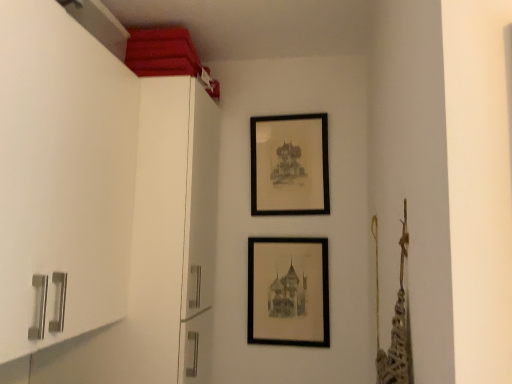
Question: Does matte black picture frame at center, positioned as the 2th picture frame in top-to-bottom order, contain black matte picture frame at upper center, which is counted as the 1th picture frame, starting from the top?

Choices:
 (A) yes
 (B) no

Answer: (B)

Question: From the image's perspective, is matte black picture frame at center, positioned as the 2th picture frame in top-to-bottom order, beneath black matte picture frame at upper center, which is counted as the 1th picture frame, starting from the top?

Choices:
 (A) yes
 (B) no

Answer: (A)

Question: Considering the relative sizes of matte black picture frame at center, arranged as the first picture frame when ordered from the bottom, and black matte picture frame at upper center, which is the 2th picture frame in bottom-to-top order, in the image provided, is matte black picture frame at center, arranged as the first picture frame when ordered from the bottom, bigger than black matte picture frame at upper center, which is the 2th picture frame in bottom-to-top order,?

Choices:
 (A) no
 (B) yes

Answer: (A)

Question: Is matte black picture frame at center, positioned as the 2th picture frame in top-to-bottom order, smaller than black matte picture frame at upper center, which is the 2th picture frame in bottom-to-top order?

Choices:
 (A) no
 (B) yes

Answer: (B)

Question: Is the depth of matte black picture frame at center, positioned as the 2th picture frame in top-to-bottom order, less than that of black matte picture frame at upper center, which is counted as the 1th picture frame, starting from the top?

Choices:
 (A) no
 (B) yes

Answer: (B)

Question: Is matte black picture frame at center, positioned as the 2th picture frame in top-to-bottom order, at the right side of black matte picture frame at upper center, which is counted as the 1th picture frame, starting from the top?

Choices:
 (A) yes
 (B) no

Answer: (B)

Question: Is black matte picture frame at upper center, which is counted as the 1th picture frame, starting from the top, to the right of matte black picture frame at center, positioned as the 2th picture frame in top-to-bottom order, from the viewer's perspective?

Choices:
 (A) yes
 (B) no

Answer: (A)

Question: From the image's perspective, would you say black matte picture frame at upper center, which is the 2th picture frame in bottom-to-top order, is shown under matte black picture frame at center, arranged as the first picture frame when ordered from the bottom?

Choices:
 (A) yes
 (B) no

Answer: (B)

Question: Considering the relative positions of black matte picture frame at upper center, which is the 2th picture frame in bottom-to-top order, and matte black picture frame at center, positioned as the 2th picture frame in top-to-bottom order, in the image provided, is black matte picture frame at upper center, which is the 2th picture frame in bottom-to-top order, to the left of matte black picture frame at center, positioned as the 2th picture frame in top-to-bottom order, from the viewer's perspective?

Choices:
 (A) yes
 (B) no

Answer: (B)

Question: Considering the relative sizes of black matte picture frame at upper center, which is the 2th picture frame in bottom-to-top order, and matte black picture frame at center, positioned as the 2th picture frame in top-to-bottom order, in the image provided, is black matte picture frame at upper center, which is the 2th picture frame in bottom-to-top order, wider than matte black picture frame at center, positioned as the 2th picture frame in top-to-bottom order,?

Choices:
 (A) no
 (B) yes

Answer: (B)

Question: Is the position of black matte picture frame at upper center, which is counted as the 1th picture frame, starting from the top, less distant than that of matte black picture frame at center, positioned as the 2th picture frame in top-to-bottom order?

Choices:
 (A) yes
 (B) no

Answer: (B)

Question: Does black matte picture frame at upper center, which is the 2th picture frame in bottom-to-top order, have a larger size compared to matte black picture frame at center, arranged as the first picture frame when ordered from the bottom?

Choices:
 (A) yes
 (B) no

Answer: (A)

Question: From the image's perspective, is matte black picture frame at center, positioned as the 2th picture frame in top-to-bottom order, positioned above or below black matte picture frame at upper center, which is counted as the 1th picture frame, starting from the top?

Choices:
 (A) below
 (B) above

Answer: (A)